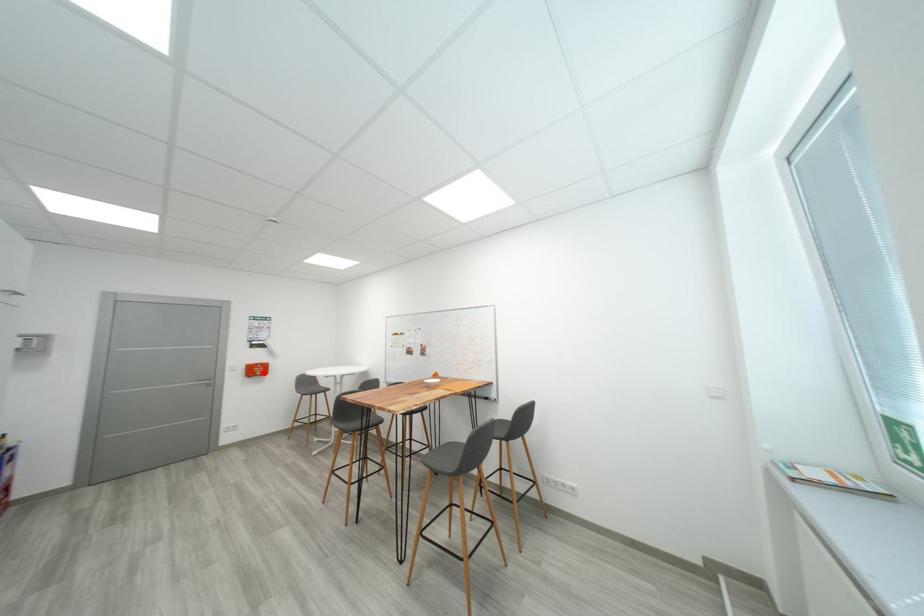
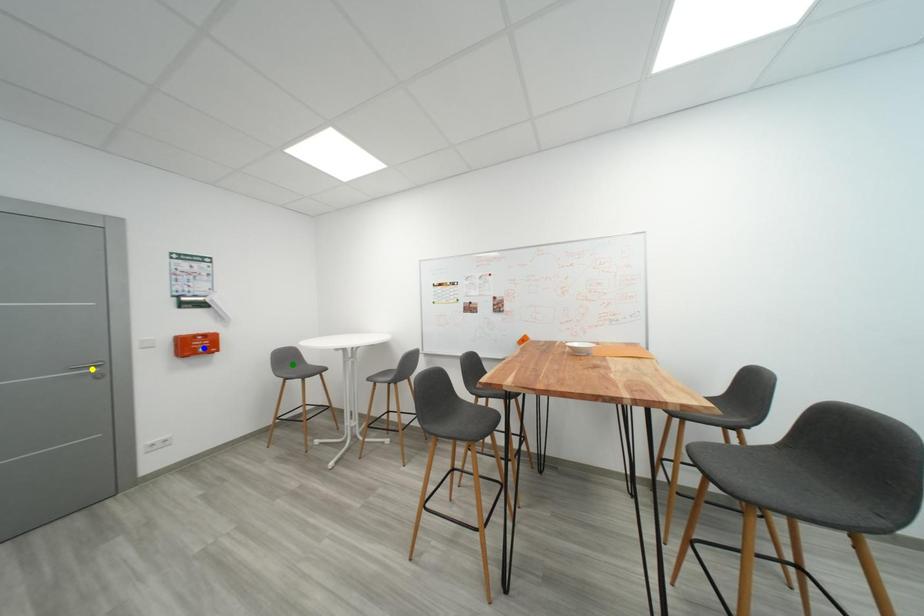
Question: I am providing you with two images of the same scene from different viewpoints. A red point is marked on the first image. You are given multiple points on the second image. Which spot in image 2 lines up with the point in image 1?

Choices:
 (A) blue point
 (B) green point
 (C) yellow point

Answer: (A)